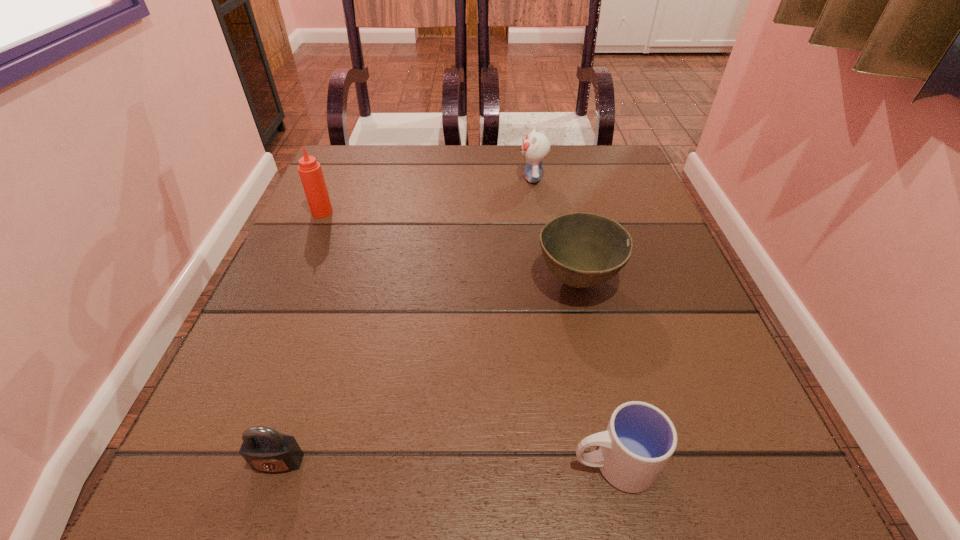
Locate an element on the screen. This screenshot has height=540, width=960. the tallest object is located at coordinates (311, 175).

Locate an element on the screen. The image size is (960, 540). the leftmost object is located at coordinates (311, 175).

Find the location of a particular element. The height and width of the screenshot is (540, 960). kitten is located at coordinates (535, 147).

The height and width of the screenshot is (540, 960). Identify the location of the farthest object. (535, 147).

This screenshot has height=540, width=960. I want to click on bowl, so click(582, 250).

This screenshot has width=960, height=540. I want to click on cup, so click(640, 439).

Identify the location of the fourth object from right to left. (264, 449).

Locate an element on the screen. Image resolution: width=960 pixels, height=540 pixels. vacant space located 0.080m on the right of the leftmost object is located at coordinates (369, 212).

In order to click on free location located on the front-facing side of the kitten in this screenshot , I will do `click(465, 178)`.

The image size is (960, 540). What are the coordinates of `free spot located 0.210m on the front-facing side of the kitten` in the screenshot? It's located at click(x=432, y=178).